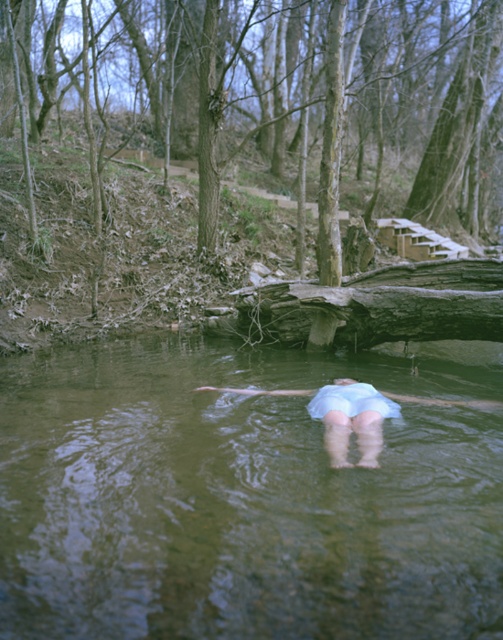
You are a swimmer who wants to float on your back in the water. You see the light blue fabric at center and the green murky water at center. Which object is located beneath the other?

The green murky water at center is positioned under the light blue fabric at center.

You are navigating a small boat along the stream shown in the image. You notice two points marked as point (120, 342) and point (243, 392). Which point should you avoid to stay closer to the direction you are currently facing?

You should avoid point (243, 392) because point (120, 342) is behind it, so staying away from point (243, 392) will keep you closer to your current direction.